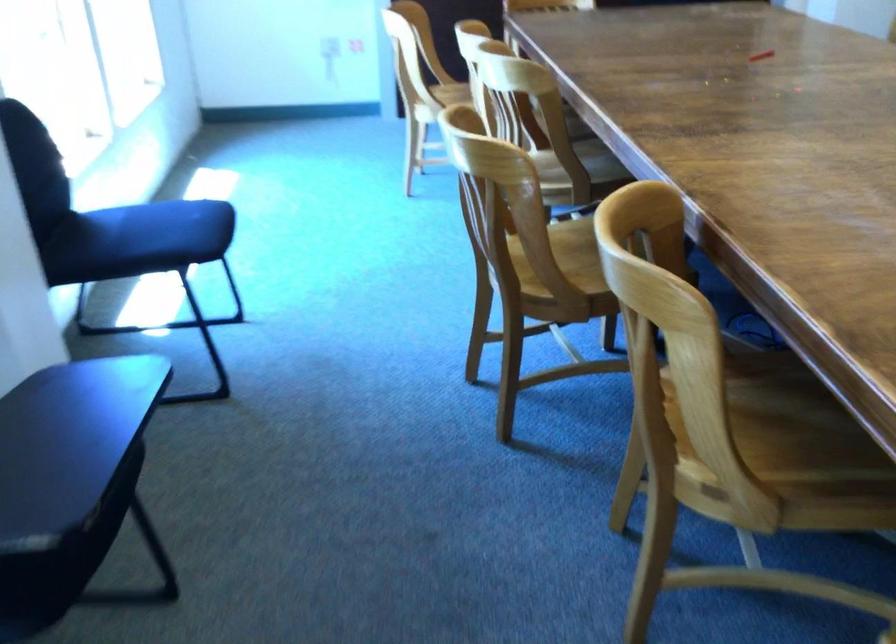
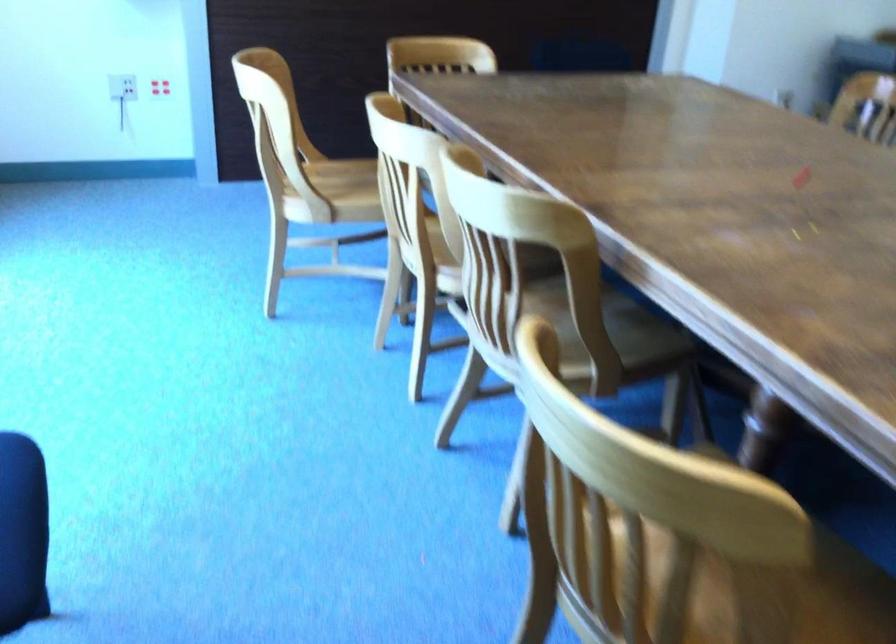
Where in the second image is the point corresponding to pixel 576 162 from the first image?

(615, 345)